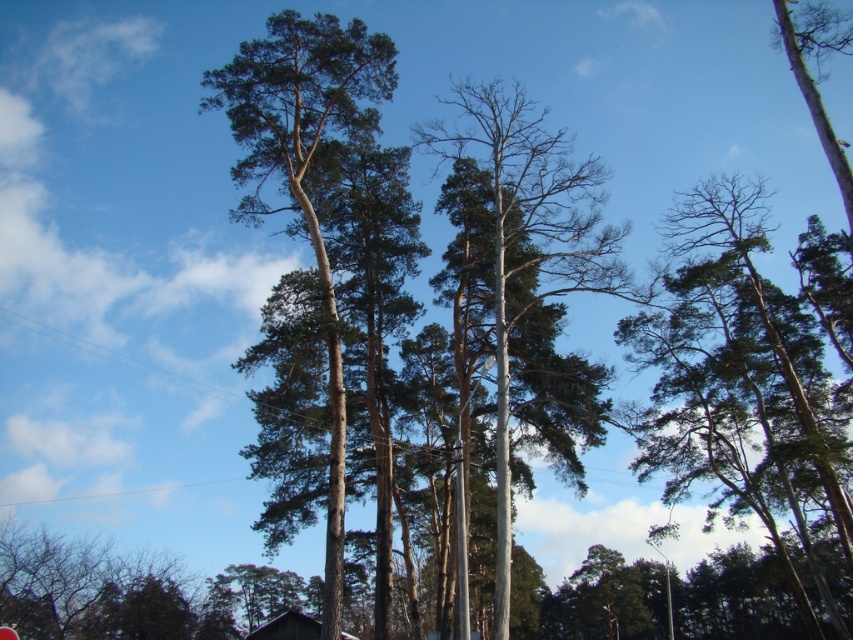
Can you confirm if green-brown bark tree at center is shorter than smooth gray tree at center?

Correct, green-brown bark tree at center is not as tall as smooth gray tree at center.

Which is behind, point (329, 116) or point (602, 272)?

The point (329, 116) is behind.

I want to click on green-brown bark tree at center, so click(305, 177).

Who is positioned more to the right, green matte tree at upper right or green-brown bark tree at center?

green matte tree at upper right is more to the right.

Between green matte tree at upper right and green-brown bark tree at center, which one is positioned lower?

green matte tree at upper right is lower down.

Who is more distant from viewer, (795, 460) or (335, 563)?

Point (795, 460)

Locate an element on the screen. green matte tree at upper right is located at coordinates (741, 387).

Is green matte tree at upper right smaller than smooth gray tree at center?

No, green matte tree at upper right is not smaller than smooth gray tree at center.

Between green matte tree at upper right and smooth gray tree at center, which one appears on the left side from the viewer's perspective?

Positioned to the left is smooth gray tree at center.

Between point (683, 339) and point (556, 291), which one is positioned in front?

Positioned in front is point (556, 291).

Identify the location of green matte tree at upper right. (741, 387).